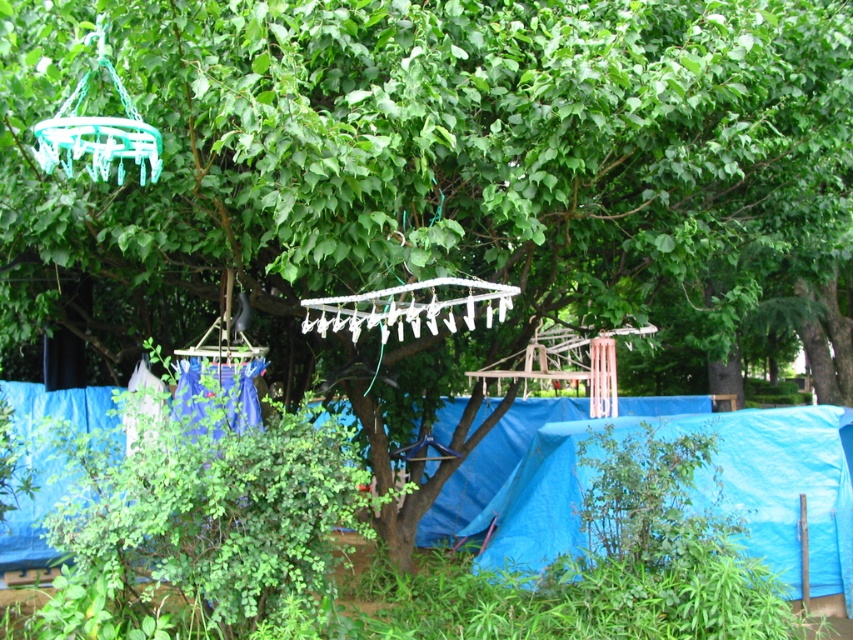
You are setting up a tent in the outdoor scene. You have two items in the center area, the blue tarpaulin at center and the white plastic clothesline at center. Which one should you move to make space for your tent?

You should move the blue tarpaulin at center to the left since it is to the right of the white plastic clothesline at center, so moving it would create space for the tent.

You are setting up a picnic area in the image. You have a picnic blanket that needs to be placed under the white plastic clothesline at center. Can the blue tarpaulin at lower right be used to cover the picnic blanket without moving the clothesline?

The blue tarpaulin at lower right is positioned under the white plastic clothesline at center. Since it is already located beneath the clothesline, you can use it to cover the picnic blanket without moving the clothesline.